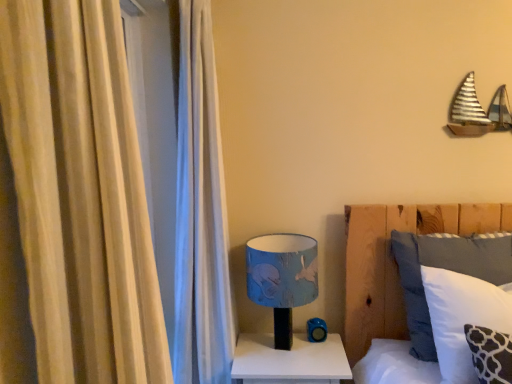
Locate an element on the screen. The width and height of the screenshot is (512, 384). free space in front of blue fabric lampshade at center is located at coordinates (287, 375).